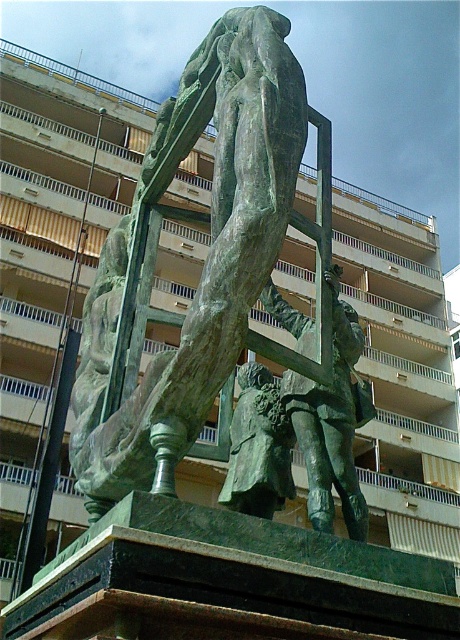
You are an art conservator assessing the space between two statues in an urban plaza. The bronze sculpture at center and the green patina statue at center are both in the same location. Which one has a greater width?

The bronze sculpture at center is wider than the green patina statue at center according to the description.

You are standing at point A located at coordinates point (207, 256). What object are you standing on?

You are standing on the bronze sculpture at center, as point (207, 256) corresponds to the bronze sculpture at center.